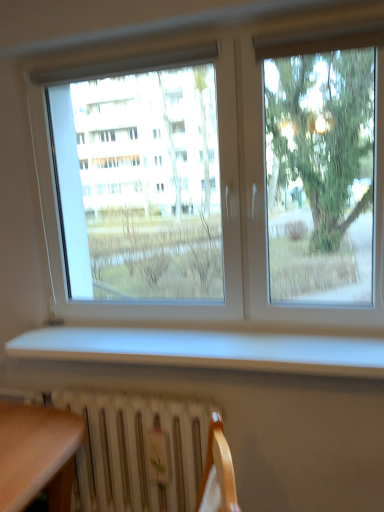
Question: Is white matte window sill at lower center placed right next to transparent glass window at center?

Choices:
 (A) yes
 (B) no

Answer: (B)

Question: Is white matte window sill at lower center facing away from transparent glass window at center?

Choices:
 (A) no
 (B) yes

Answer: (B)

Question: Can you confirm if white matte window sill at lower center is thinner than transparent glass window at center?

Choices:
 (A) no
 (B) yes

Answer: (A)

Question: Is there a large distance between white matte window sill at lower center and transparent glass window at center?

Choices:
 (A) no
 (B) yes

Answer: (B)

Question: Can you confirm if white matte window sill at lower center is positioned to the left of transparent glass window at center?

Choices:
 (A) no
 (B) yes

Answer: (B)

Question: Is white matte window sill at lower center completely or partially outside of transparent glass window at center?

Choices:
 (A) no
 (B) yes

Answer: (B)

Question: Considering the relative positions of transparent glass window at center and white metallic radiator at lower center in the image provided, is transparent glass window at center to the left of white metallic radiator at lower center from the viewer's perspective?

Choices:
 (A) yes
 (B) no

Answer: (B)

Question: Are transparent glass window at center and white metallic radiator at lower center far apart?

Choices:
 (A) no
 (B) yes

Answer: (B)

Question: From the image's perspective, is transparent glass window at center located beneath white metallic radiator at lower center?

Choices:
 (A) no
 (B) yes

Answer: (A)

Question: Can you confirm if transparent glass window at center is thinner than white metallic radiator at lower center?

Choices:
 (A) no
 (B) yes

Answer: (B)

Question: Does transparent glass window at center have a larger size compared to white metallic radiator at lower center?

Choices:
 (A) no
 (B) yes

Answer: (B)

Question: Is the position of transparent glass window at center more distant than that of white metallic radiator at lower center?

Choices:
 (A) no
 (B) yes

Answer: (A)

Question: From a real-world perspective, is transparent glass window at center on top of white matte window sill at lower center?

Choices:
 (A) yes
 (B) no

Answer: (A)